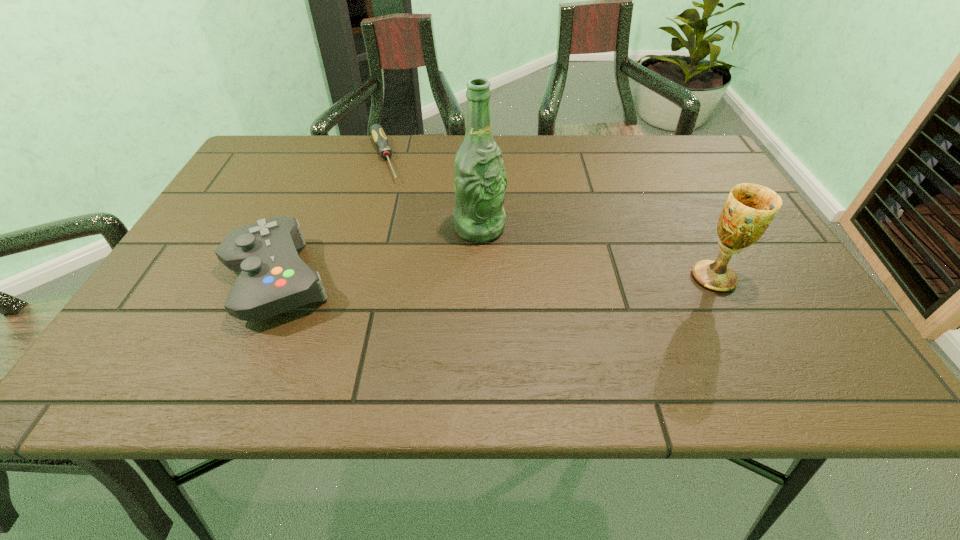
Find the location of `control`. control is located at coordinates (273, 279).

You are a GUI agent. You are given a task and a screenshot of the screen. Output one action in this format:
    pyautogui.click(x=<x>, y=<y>)
    Task: Click on the third shortest object
    This screenshot has width=960, height=540.
    Given the screenshot: What is the action you would take?
    pyautogui.click(x=750, y=208)

I want to click on the rightmost object, so click(750, 208).

I want to click on the tallest object, so click(x=480, y=181).

The height and width of the screenshot is (540, 960). What are the coordinates of `beer bottle` in the screenshot? It's located at (480, 181).

The height and width of the screenshot is (540, 960). Identify the location of the shortest object. (376, 130).

This screenshot has height=540, width=960. What are the coordinates of `the farthest object` in the screenshot? It's located at (376, 130).

Locate an element on the screen. The width and height of the screenshot is (960, 540). free spot located on the back of the third tallest object is located at coordinates (306, 214).

This screenshot has height=540, width=960. In order to click on vacant point located 0.290m on the left of the chalice in this screenshot , I will do `click(554, 278)`.

What are the coordinates of `vacant space located 0.320m on the surface of the beer bottle` in the screenshot? It's located at (599, 333).